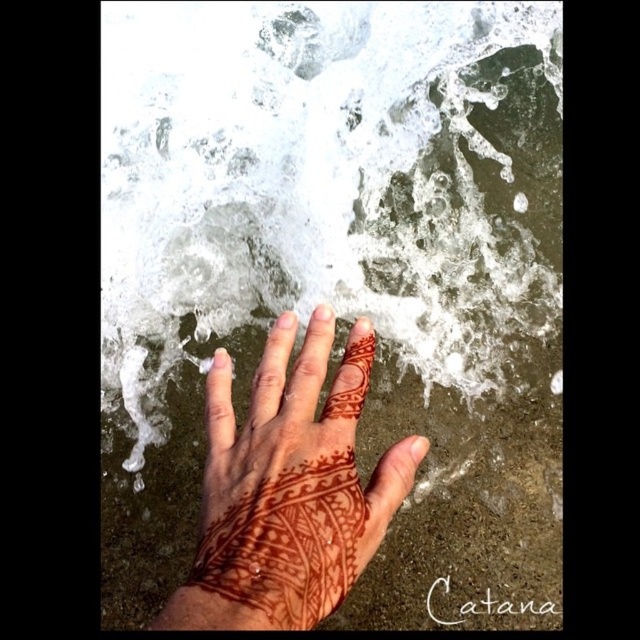
From the picture: Between white frothy water at center and brown henna tattoo at center, which one appears on the left side from the viewer's perspective?

From the viewer's perspective, brown henna tattoo at center appears more on the left side.

Which is in front, point (461, 68) or point (269, 388)?

Positioned in front is point (269, 388).

The image size is (640, 640). What are the coordinates of `white frothy water at center` in the screenshot? It's located at (330, 186).